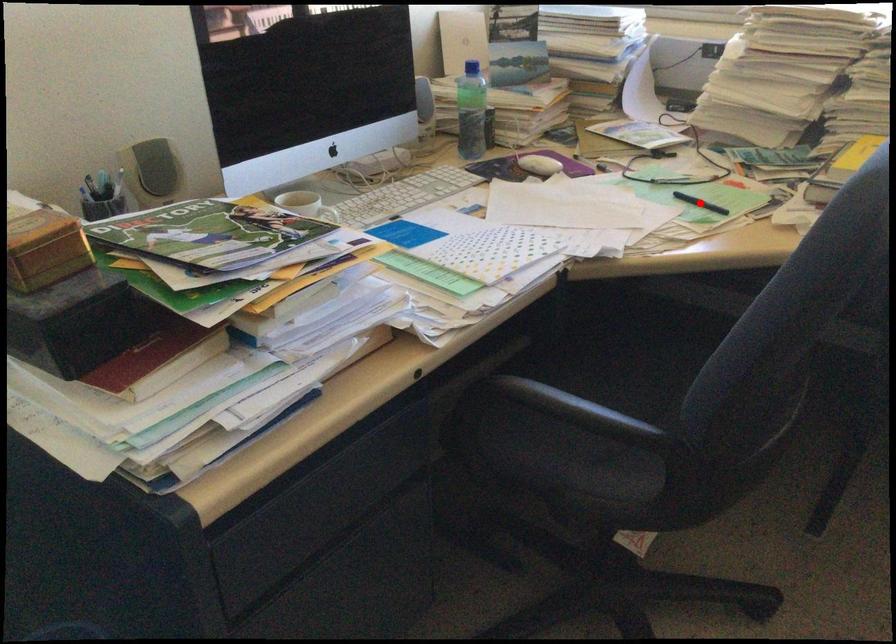
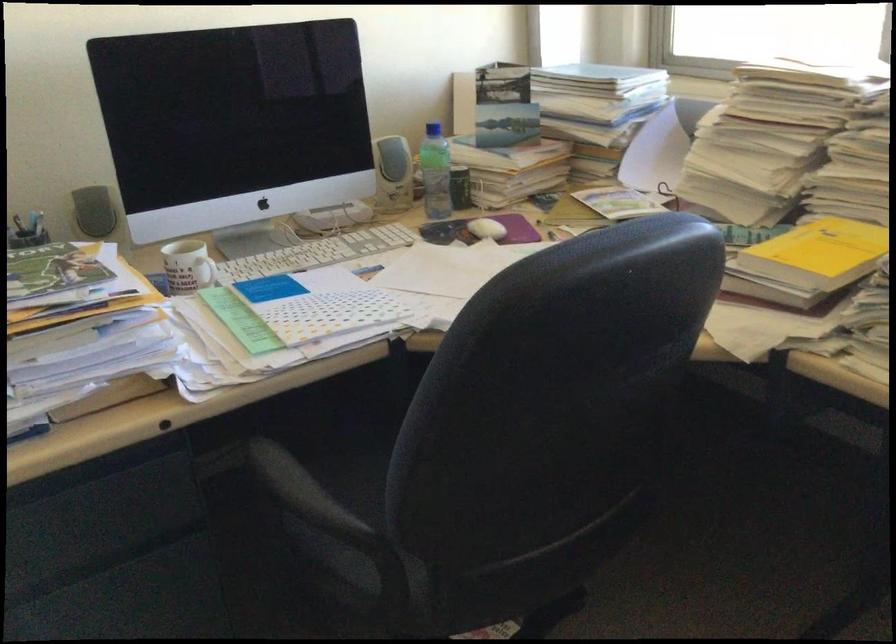
Question: I am providing you with two images of the same scene from different viewpoints. A red point is marked on the first image. At the location where the point appears in image 1, is it still visible in image 2?

Choices:
 (A) Yes
 (B) No

Answer: (B)